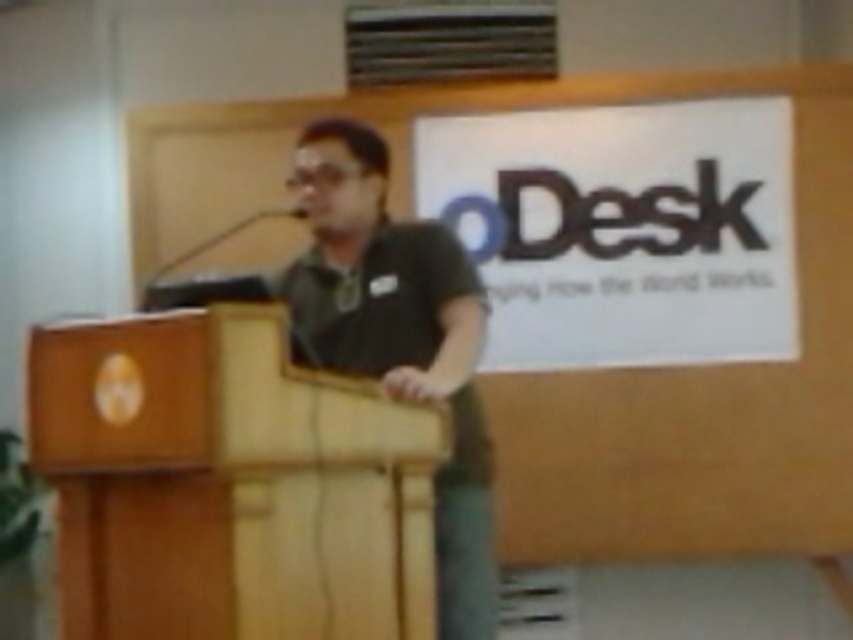
Question: Is wooden podium at center thinner than black matte shirt at center?

Choices:
 (A) no
 (B) yes

Answer: (A)

Question: Where is wooden podium at center located in relation to black matte shirt at center in the image?

Choices:
 (A) above
 (B) below

Answer: (B)

Question: Which point appears farthest from the camera in this image?

Choices:
 (A) (306, 150)
 (B) (74, 576)

Answer: (A)

Question: Observing the image, what is the correct spatial positioning of wooden podium at center in reference to black matte shirt at center?

Choices:
 (A) right
 (B) left

Answer: (B)